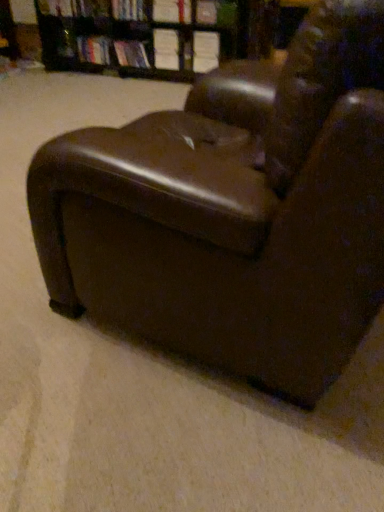
Question: Considering the relative sizes of brown leather armchair at center and white paper book at upper center, which ranks as the 5th book in left-to-right order, in the image provided, is brown leather armchair at center taller than white paper book at upper center, which ranks as the 5th book in left-to-right order,?

Choices:
 (A) yes
 (B) no

Answer: (A)

Question: Is brown leather armchair at center beside white paper book at upper center, which ranks as the 2th book in right-to-left order?

Choices:
 (A) no
 (B) yes

Answer: (A)

Question: Is brown leather armchair at center thinner than white paper book at upper center, which ranks as the 5th book in left-to-right order?

Choices:
 (A) yes
 (B) no

Answer: (B)

Question: Is white paper book at upper center, which ranks as the 2th book in right-to-left order, inside brown leather armchair at center?

Choices:
 (A) no
 (B) yes

Answer: (A)

Question: Can you confirm if brown leather armchair at center is positioned to the left of white paper book at upper center, which ranks as the 2th book in right-to-left order?

Choices:
 (A) yes
 (B) no

Answer: (B)

Question: Is brown leather bookcase at upper center inside the boundaries of brown leather armchair at center, or outside?

Choices:
 (A) outside
 (B) inside

Answer: (A)

Question: From a real-world perspective, relative to brown leather armchair at center, is brown leather bookcase at upper center vertically above or below?

Choices:
 (A) below
 (B) above

Answer: (A)

Question: From their relative heights in the image, would you say brown leather bookcase at upper center is taller or shorter than brown leather armchair at center?

Choices:
 (A) tall
 (B) short

Answer: (B)

Question: In terms of width, does brown leather bookcase at upper center look wider or thinner when compared to brown leather armchair at center?

Choices:
 (A) thin
 (B) wide

Answer: (A)

Question: Considering the positions of hardcover book at center, positioned as the 6th book in left-to-right order, and brown leather armchair at center in the image, is hardcover book at center, positioned as the 6th book in left-to-right order, taller or shorter than brown leather armchair at center?

Choices:
 (A) tall
 (B) short

Answer: (B)

Question: From a real-world perspective, is hardcover book at center, positioned as the 6th book in left-to-right order, physically located above or below brown leather armchair at center?

Choices:
 (A) below
 (B) above

Answer: (B)

Question: From the image's perspective, is hardcover book at center, positioned as the 6th book in left-to-right order, positioned above or below brown leather armchair at center?

Choices:
 (A) above
 (B) below

Answer: (A)

Question: Based on their sizes in the image, would you say hardcover book at center, positioned as the 6th book in left-to-right order, is bigger or smaller than brown leather armchair at center?

Choices:
 (A) big
 (B) small

Answer: (B)

Question: Is hardcover book at upper center, which ranks as the second book in left-to-right order, inside or outside of white paper book at upper center, the fourth book from the left?

Choices:
 (A) outside
 (B) inside

Answer: (A)

Question: Based on their positions, is hardcover book at upper center, which ranks as the second book in left-to-right order, located to the left or right of white paper book at upper center, the fourth book from the left?

Choices:
 (A) left
 (B) right

Answer: (A)